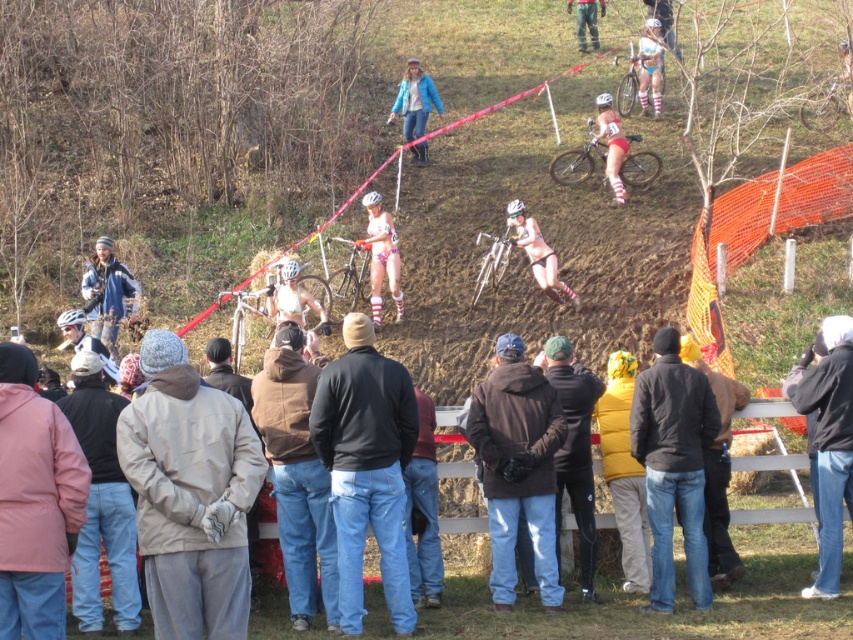
Question: Which object appears farthest from the camera in this image?

Choices:
 (A) beige fabric jacket at center
 (B) denim jacket at center
 (C) denim jacket at left
 (D) dark brown leather jacket at center

Answer: (C)

Question: Is beige fabric jacket at center thinner than light gray jacket at lower left?

Choices:
 (A) no
 (B) yes

Answer: (A)

Question: Is brown cotton hoodie at center positioned behind matte pink bicycle at upper center?

Choices:
 (A) no
 (B) yes

Answer: (A)

Question: Which point is farther from the camera taking this photo?

Choices:
 (A) (74, 550)
 (B) (345, 310)
 (C) (369, 280)

Answer: (C)

Question: Which of these objects is positioned closest to the light gray jacket at lower left?

Choices:
 (A) light pink jacket at lower left
 (B) beige fabric jacket at center

Answer: (B)

Question: Can you confirm if beige fabric jacket at center is positioned above light pink jacket at lower left?

Choices:
 (A) no
 (B) yes

Answer: (A)